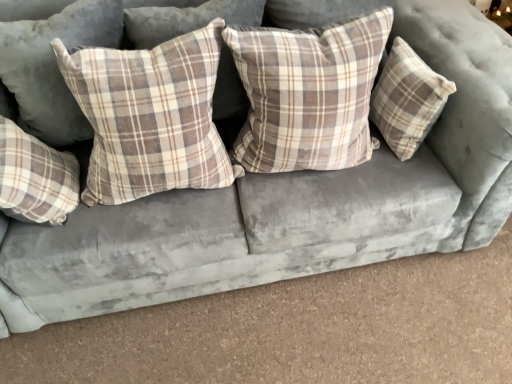
Question: Can you confirm if plaid fabric pillow at center, acting as the 4th pillow starting from the left, is taller than plaid fabric pillow at left, which is the 2th pillow in left-to-right order?

Choices:
 (A) yes
 (B) no

Answer: (A)

Question: Can you confirm if plaid fabric pillow at center, acting as the 4th pillow starting from the left, is positioned to the right of plaid fabric pillow at left, which is counted as the fourth pillow, starting from the right?

Choices:
 (A) no
 (B) yes

Answer: (B)

Question: From a real-world perspective, is plaid fabric pillow at center, acting as the 4th pillow starting from the left, positioned over plaid fabric pillow at left, which is the 2th pillow in left-to-right order, based on gravity?

Choices:
 (A) no
 (B) yes

Answer: (B)

Question: From a real-world perspective, is plaid fabric pillow at center, acting as the 4th pillow starting from the left, beneath plaid fabric pillow at left, which is the 2th pillow in left-to-right order?

Choices:
 (A) no
 (B) yes

Answer: (A)

Question: Is plaid fabric pillow at center, arranged as the 2th pillow when viewed from the right, not inside plaid fabric pillow at left, which is counted as the fourth pillow, starting from the right?

Choices:
 (A) no
 (B) yes

Answer: (B)

Question: Considering the positions of plaid fabric pillow at upper left, the fifth pillow when ordered from right to left, and plaid fabric pillow at center, which is the 3th pillow from right to left, in the image, is plaid fabric pillow at upper left, the fifth pillow when ordered from right to left, wider or thinner than plaid fabric pillow at center, which is the 3th pillow from right to left,?

Choices:
 (A) thin
 (B) wide

Answer: (B)

Question: From the image's perspective, is plaid fabric pillow at upper left, the fifth pillow when ordered from right to left, located above or below plaid fabric pillow at center, the 3th pillow when ordered from left to right?

Choices:
 (A) above
 (B) below

Answer: (A)

Question: Is plaid fabric pillow at upper left, the fifth pillow when ordered from right to left, taller or shorter than plaid fabric pillow at center, the 3th pillow when ordered from left to right?

Choices:
 (A) tall
 (B) short

Answer: (A)

Question: In the image, is plaid fabric pillow at upper left, the 1th pillow from the left, on the left side or the right side of plaid fabric pillow at center, the 3th pillow when ordered from left to right?

Choices:
 (A) left
 (B) right

Answer: (A)

Question: Looking at their shapes, would you say plaid fabric pillow at center, acting as the 4th pillow starting from the left, is wider or thinner than plaid fabric pillow at right, marked as the first pillow in a right-to-left arrangement?

Choices:
 (A) thin
 (B) wide

Answer: (B)

Question: In the image, is plaid fabric pillow at center, arranged as the 2th pillow when viewed from the right, positioned in front of or behind plaid fabric pillow at right, marked as the first pillow in a right-to-left arrangement?

Choices:
 (A) behind
 (B) front

Answer: (B)

Question: From the image's perspective, is plaid fabric pillow at center, arranged as the 2th pillow when viewed from the right, above or below plaid fabric pillow at right, marked as the first pillow in a right-to-left arrangement?

Choices:
 (A) below
 (B) above

Answer: (A)

Question: Considering the positions of point (358, 23) and point (409, 107), is point (358, 23) closer or farther from the camera than point (409, 107)?

Choices:
 (A) closer
 (B) farther

Answer: (A)

Question: Considering the positions of point (270, 135) and point (53, 180), is point (270, 135) closer or farther from the camera than point (53, 180)?

Choices:
 (A) closer
 (B) farther

Answer: (B)

Question: Is plaid fabric pillow at center, acting as the 4th pillow starting from the left, in front of or behind plaid fabric pillow at left, which is counted as the fourth pillow, starting from the right, in the image?

Choices:
 (A) behind
 (B) front

Answer: (B)